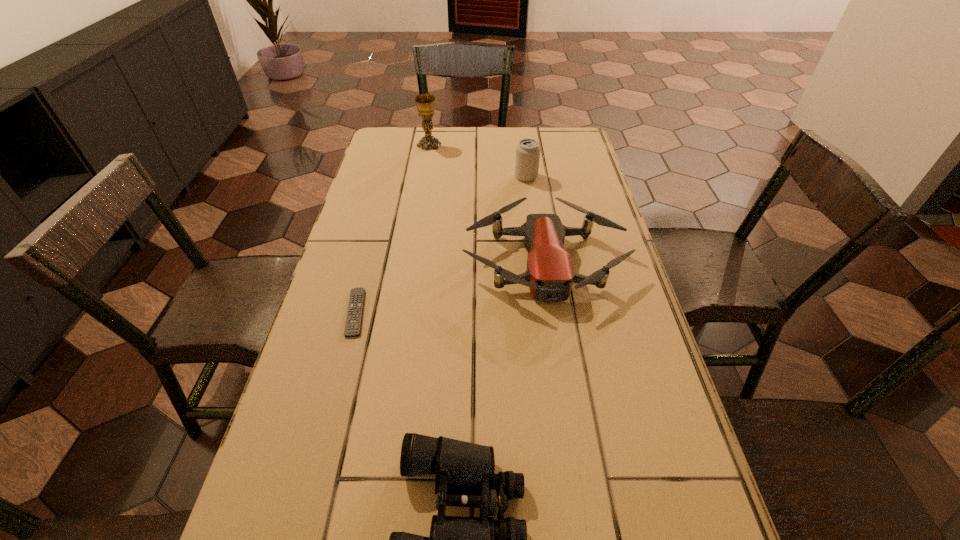
I want to click on vacant region that satisfies the following two spatial constraints: 1. on the back side of the can; 2. on the left side of the leftmost object, so click(391, 177).